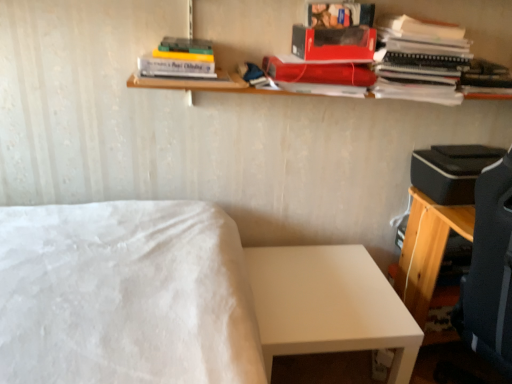
This screenshot has height=384, width=512. I want to click on white matte table at lower right, so click(x=329, y=305).

Describe the element at coordinates (329, 305) in the screenshot. I see `white matte table at lower right` at that location.

The image size is (512, 384). Describe the element at coordinates (485, 78) in the screenshot. I see `matte black notebook at upper right, marked as the third book in a left-to-right arrangement` at that location.

What do you see at coordinates (420, 60) in the screenshot? Image resolution: width=512 pixels, height=384 pixels. I see `matte red book at upper right, arranged as the 2th book when viewed from the right` at bounding box center [420, 60].

Image resolution: width=512 pixels, height=384 pixels. What are the coordinates of `shiny red paperback book at upper center, marked as the 2th paperback book in a bottom-to-top arrangement` in the screenshot? It's located at (319, 72).

Image resolution: width=512 pixels, height=384 pixels. What do you see at coordinates (319, 72) in the screenshot? I see `shiny red paperback book at upper center, which is counted as the second paperback book, starting from the top` at bounding box center [319, 72].

Locate an element on the screen. The height and width of the screenshot is (384, 512). white matte table at lower right is located at coordinates (329, 305).

Is the surface of wooden shelf at upper center in direct contact with matte black notebook at upper right, placed as the first book when sorted from right to left?

They are not placed beside each other.

From the picture: From the image's perspective, which object appears higher, wooden shelf at upper center or matte black notebook at upper right, marked as the third book in a left-to-right arrangement?

wooden shelf at upper center appears higher in the image.

From the picture: Does wooden shelf at upper center lie in front of matte black notebook at upper right, marked as the third book in a left-to-right arrangement?

Yes, wooden shelf at upper center is closer to the camera.

Identify the location of book that is under the wooden shelf at upper center (from a real-world perspective). Image resolution: width=512 pixels, height=384 pixels. (485, 78).

Can you confirm if white matte table at lower right is positioned to the right of wooden shelf at upper center?

No.

Is white matte table at lower right facing away from wooden shelf at upper center?

No.

Which point is more forward, (358, 260) or (433, 14)?

The point (433, 14) is closer to the camera.

Considering the relative sizes of white matte table at lower right and wooden shelf at upper center in the image provided, is white matte table at lower right shorter than wooden shelf at upper center?

In fact, white matte table at lower right may be taller than wooden shelf at upper center.

Between matte red book at upper right, arranged as the 2th book when viewed from the right, and white matte table at lower right, which one has smaller size?

With smaller size is matte red book at upper right, arranged as the 2th book when viewed from the right.

Is matte red book at upper right, marked as the 2th book in a left-to-right arrangement, aimed at white matte table at lower right?

No, matte red book at upper right, marked as the 2th book in a left-to-right arrangement, is not turned towards white matte table at lower right.

Which of these two, matte red book at upper right, arranged as the 2th book when viewed from the right, or white matte table at lower right, is wider?

white matte table at lower right is wider.

Which object is closer to the camera taking this photo, matte red book at upper right, arranged as the 2th book when viewed from the right, or white matte table at lower right?

matte red book at upper right, arranged as the 2th book when viewed from the right, is closer to the camera.

Does matte red paperback book at upper center, which is counted as the third paperback book, starting from the bottom, have a greater width compared to white matte bed at center?

Incorrect, the width of matte red paperback book at upper center, which is counted as the third paperback book, starting from the bottom, does not surpass that of white matte bed at center.

From the image's perspective, between matte red paperback book at upper center, the first paperback book viewed from the top, and white matte bed at center, which one is located above?

Answer: From the image's view, matte red paperback book at upper center, the first paperback book viewed from the top, is above.

Who is more distant, matte red paperback book at upper center, which is counted as the third paperback book, starting from the bottom, or white matte bed at center?

Positioned behind is matte red paperback book at upper center, which is counted as the third paperback book, starting from the bottom.

Which is closer, (329, 38) or (207, 208)?

Point (329, 38) is positioned closer to the camera compared to point (207, 208).

Between shiny red paperback book at upper center, marked as the 2th paperback book in a bottom-to-top arrangement, and wooden shelf at upper center, which one is positioned behind?

shiny red paperback book at upper center, marked as the 2th paperback book in a bottom-to-top arrangement, is further away from the camera.

Who is smaller, shiny red paperback book at upper center, marked as the 2th paperback book in a bottom-to-top arrangement, or wooden shelf at upper center?

shiny red paperback book at upper center, marked as the 2th paperback book in a bottom-to-top arrangement, is smaller.

Between shiny red paperback book at upper center, which is counted as the second paperback book, starting from the top, and wooden shelf at upper center, which one has larger width?

wooden shelf at upper center is wider.

Find the location of `shelf in front of the shiny red paperback book at upper center, which is counted as the second paperback book, starting from the top`. shelf in front of the shiny red paperback book at upper center, which is counted as the second paperback book, starting from the top is located at coordinates (247, 27).

From a real-world perspective, which is physically above, shiny red paperback book at upper center, marked as the 2th paperback book in a bottom-to-top arrangement, or matte red book at upper right, arranged as the 2th book when viewed from the right?

matte red book at upper right, arranged as the 2th book when viewed from the right, is physically above.

Can you confirm if shiny red paperback book at upper center, which is counted as the second paperback book, starting from the top, is positioned to the left of matte red book at upper right, arranged as the 2th book when viewed from the right?

Result: Yes, shiny red paperback book at upper center, which is counted as the second paperback book, starting from the top, is to the left of matte red book at upper right, arranged as the 2th book when viewed from the right.

Would you say shiny red paperback book at upper center, marked as the 2th paperback book in a bottom-to-top arrangement, is a long distance from matte red book at upper right, marked as the 2th book in a left-to-right arrangement?

They are positioned close to each other.

The width and height of the screenshot is (512, 384). Find the location of `book that is the 1st object above the shiny red paperback book at upper center, which is counted as the second paperback book, starting from the top (from a real-world perspective)`. book that is the 1st object above the shiny red paperback book at upper center, which is counted as the second paperback book, starting from the top (from a real-world perspective) is located at coordinates (420, 60).

Could you tell me if white matte bed at center is facing matte red paperback book at upper center, which is the 1th paperback book in bottom-to-top order?

No.

From the image's perspective, between white matte bed at center and matte red paperback book at upper center, which is the 1th paperback book in bottom-to-top order, which one is located above?

matte red paperback book at upper center, which is the 1th paperback book in bottom-to-top order, is shown above in the image.

Would you say white matte bed at center is outside matte red paperback book at upper center, which is the 1th paperback book in bottom-to-top order?

Yes, white matte bed at center is outside of matte red paperback book at upper center, which is the 1th paperback book in bottom-to-top order.

Is white matte bed at center wider or thinner than matte red paperback book at upper center, which is the 1th paperback book in bottom-to-top order?

Clearly, white matte bed at center has more width compared to matte red paperback book at upper center, which is the 1th paperback book in bottom-to-top order.

Locate an element on the screen. shelf on the left of matte black notebook at upper right, placed as the first book when sorted from right to left is located at coordinates (247, 27).

At what (x,y) coordinates should I click in order to perform the action: click on table below the wooden shelf at upper center (from the image's perspective). Please return your answer as a coordinate pair (x, y). Looking at the image, I should click on (329, 305).

When comparing their distances from white matte bed at center, does matte red book at upper right, arranged as the 2th book when viewed from the right, or matte black notebook at upper right, marked as the third book in a left-to-right arrangement, seem further?

matte black notebook at upper right, marked as the third book in a left-to-right arrangement.

From the image, which object appears to be nearer to white matte table at lower right, matte red paperback book at upper center, which is the 1th paperback book in bottom-to-top order, or white matte bed at center?

white matte bed at center is positioned closer to the anchor white matte table at lower right.

Which object lies nearer to the anchor point matte red paperback book at upper center, which is counted as the third paperback book, starting from the bottom, matte red book at upper right, arranged as the 2th book when viewed from the right, or white matte table at lower right?

matte red book at upper right, arranged as the 2th book when viewed from the right, is positioned closer to the anchor matte red paperback book at upper center, which is counted as the third paperback book, starting from the bottom.

Considering their positions, is wooden shelf at upper center positioned further to hardcover book at upper center, the 1th book in the left-to-right sequence, than matte red paperback book at upper center, which is the 1th paperback book in bottom-to-top order?

Based on the image, wooden shelf at upper center appears to be further to hardcover book at upper center, the 1th book in the left-to-right sequence.

Estimate the real-world distances between objects in this image. Which object is further from matte black notebook at upper right, marked as the third book in a left-to-right arrangement, wooden shelf at upper center or matte red paperback book at upper center, the first paperback book viewed from the top?

The object further to matte black notebook at upper right, marked as the third book in a left-to-right arrangement, is matte red paperback book at upper center, the first paperback book viewed from the top.

Estimate the real-world distances between objects in this image. Which object is closer to white matte table at lower right, hardcover book at upper center, the 1th book in the left-to-right sequence, or matte red paperback book at upper center, which is the 1th paperback book in bottom-to-top order?

matte red paperback book at upper center, which is the 1th paperback book in bottom-to-top order, is positioned closer to the anchor white matte table at lower right.

Considering their positions, is matte black notebook at upper right, placed as the first book when sorted from right to left, positioned closer to hardcover book at upper center, arranged as the third book when viewed from the right, than white matte bed at center?

matte black notebook at upper right, placed as the first book when sorted from right to left, is positioned closer to the anchor hardcover book at upper center, arranged as the third book when viewed from the right.

Looking at the image, which one is located further to shiny red paperback book at upper center, marked as the 2th paperback book in a bottom-to-top arrangement, white matte bed at center or matte red paperback book at upper center, which appears as the third paperback book when viewed from the top?

Among the two, white matte bed at center is located further to shiny red paperback book at upper center, marked as the 2th paperback book in a bottom-to-top arrangement.

Locate an element on the screen. shelf that lies between hardcover book at upper center, the 1th book in the left-to-right sequence, and white matte bed at center from top to bottom is located at coordinates pos(247,27).

At what (x,y) coordinates should I click in order to perform the action: click on shelf between shiny red paperback book at upper center, marked as the 2th paperback book in a bottom-to-top arrangement, and matte black notebook at upper right, placed as the first book when sorted from right to left. Please return your answer as a coordinate pair (x, y). The image size is (512, 384). Looking at the image, I should click on (247, 27).

Find the location of a particular element. The image size is (512, 384). shelf between matte red paperback book at upper center, the first paperback book viewed from the top, and matte red book at upper right, arranged as the 2th book when viewed from the right, from left to right is located at coordinates (247, 27).

This screenshot has width=512, height=384. I want to click on book between matte red paperback book at upper center, the first paperback book viewed from the top, and matte red book at upper right, marked as the 2th book in a left-to-right arrangement, in the horizontal direction, so click(x=340, y=15).